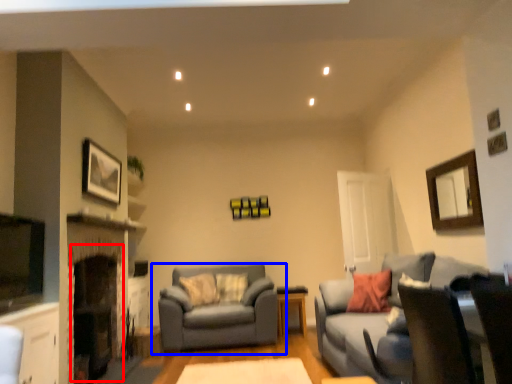
Question: Which object appears farthest to the camera in this image, fireplace (highlighted by a red box) or studio couch (highlighted by a blue box)?

Choices:
 (A) fireplace
 (B) studio couch

Answer: (B)